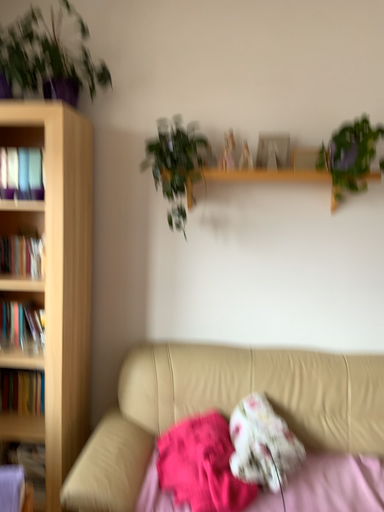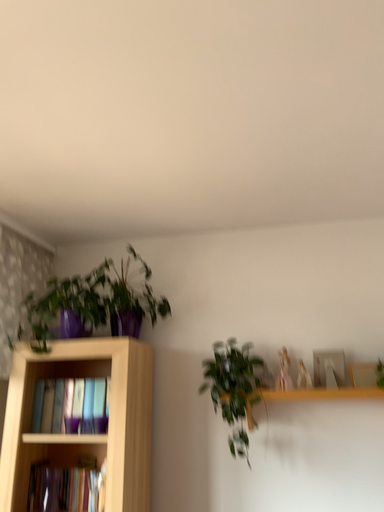
Question: Which way did the camera rotate in the video?

Choices:
 (A) rotated downward
 (B) rotated upward

Answer: (B)